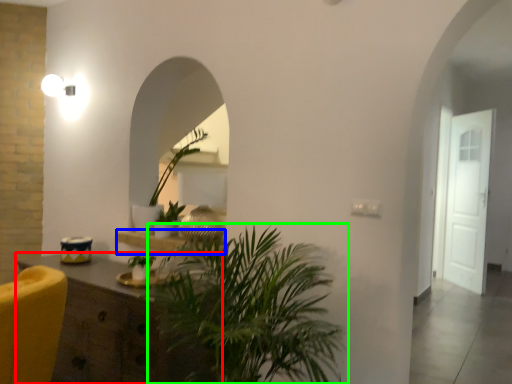
Question: Based on their relative distances, which object is farther from cabinetry (highlighted by a red box)? Choose from shelf (highlighted by a blue box) and houseplant (highlighted by a green box).

Choices:
 (A) shelf
 (B) houseplant

Answer: (A)